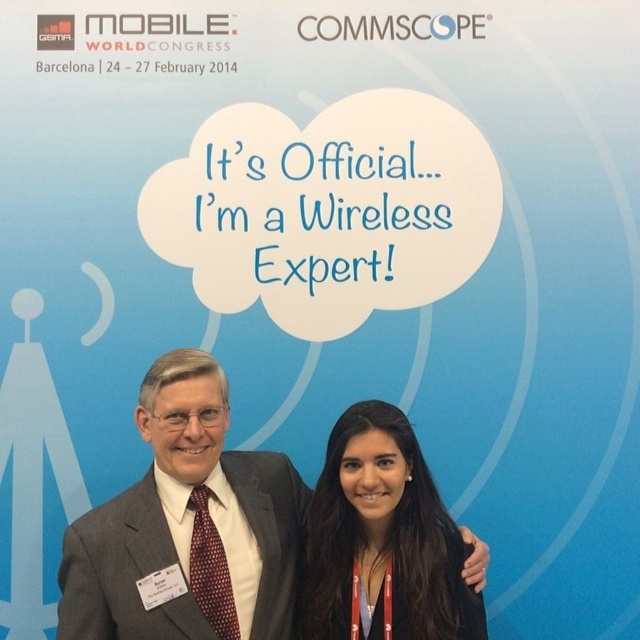
Question: Does gray suit at center appear under black leather jacket at lower center?

Choices:
 (A) no
 (B) yes

Answer: (A)

Question: Can you confirm if gray suit at center is thinner than black leather jacket at lower center?

Choices:
 (A) yes
 (B) no

Answer: (B)

Question: Is gray suit at center thinner than black leather jacket at lower center?

Choices:
 (A) yes
 (B) no

Answer: (B)